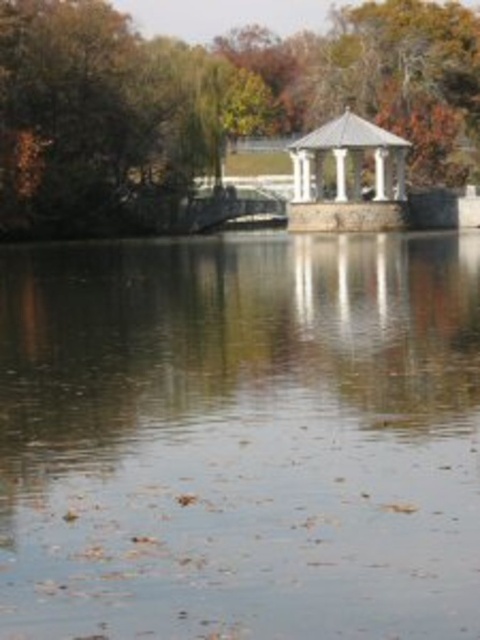
Question: Does green leafy tree at upper left appear on the right side of white stone gazebo at center?

Choices:
 (A) yes
 (B) no

Answer: (B)

Question: Can you confirm if clear water at center is positioned to the left of green leafy tree at upper left?

Choices:
 (A) yes
 (B) no

Answer: (A)

Question: Which object appears farthest from the camera in this image?

Choices:
 (A) clear water at center
 (B) white stone gazebo at center

Answer: (B)

Question: Can you confirm if green leafy tree at upper left is positioned to the left of white stone gazebo at center?

Choices:
 (A) no
 (B) yes

Answer: (B)

Question: Among these objects, which one is nearest to the camera?

Choices:
 (A) white stone gazebo at center
 (B) green leafy tree at upper left

Answer: (B)

Question: Which point appears farthest from the camera in this image?

Choices:
 (A) click(360, 141)
 (B) click(432, 152)

Answer: (B)